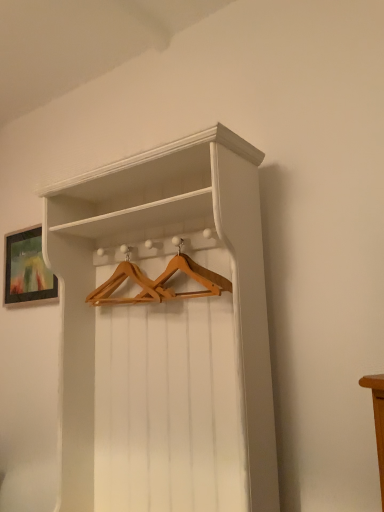
What do you see at coordinates (159, 282) in the screenshot?
I see `wooden hanger at center` at bounding box center [159, 282].

What is the approximate height of matte black picture frame at upper left?

matte black picture frame at upper left is 18.61 inches tall.

Describe the element at coordinates (27, 269) in the screenshot. Image resolution: width=384 pixels, height=512 pixels. I see `matte black picture frame at upper left` at that location.

I want to click on white wood shelf at center, so (x=165, y=332).

Describe the element at coordinates (165, 332) in the screenshot. I see `white wood shelf at center` at that location.

Where is `wooden hanger at center`? The width and height of the screenshot is (384, 512). wooden hanger at center is located at coordinates (159, 282).

Considering the positions of points (20, 286) and (170, 326), is point (20, 286) farther from camera compared to point (170, 326)?

Yes, it is behind point (170, 326).

Does matte black picture frame at upper left turn towards white wood shelf at center?

No, matte black picture frame at upper left is not turned towards white wood shelf at center.

Are matte black picture frame at upper left and white wood shelf at center beside each other?

No, matte black picture frame at upper left is not next to white wood shelf at center.

From a real-world perspective, is matte black picture frame at upper left below white wood shelf at center?

Incorrect, from a real-world perspective, matte black picture frame at upper left is higher than white wood shelf at center.

From the picture: Is wooden hanger at center in front of or behind matte black picture frame at upper left in the image?

Visually, wooden hanger at center is located in front of matte black picture frame at upper left.

Looking at this image, in the image, is wooden hanger at center on the left side or the right side of matte black picture frame at upper left?

wooden hanger at center is to the right of matte black picture frame at upper left.

Is wooden hanger at center turned away from matte black picture frame at upper left?

That's not correct — wooden hanger at center is not looking away from matte black picture frame at upper left.

From a real-world perspective, between wooden hanger at center and matte black picture frame at upper left, who is vertically higher?

From a 3D spatial view, matte black picture frame at upper left is above.

Does white wood shelf at center have a greater height compared to matte black picture frame at upper left?

Yes.

Considering the positions of point (171, 365) and point (14, 241), is point (171, 365) closer or farther from the camera than point (14, 241)?

Point (171, 365) is closer to the camera than point (14, 241).

How distant is white wood shelf at center from matte black picture frame at upper left?

They are 31.41 inches apart.

Which of these two, white wood shelf at center or matte black picture frame at upper left, is smaller?

matte black picture frame at upper left is smaller.

Is matte black picture frame at upper left wider or thinner than wooden hanger at center?

In the image, matte black picture frame at upper left appears to be more narrow than wooden hanger at center.

Considering the sizes of objects matte black picture frame at upper left and wooden hanger at center in the image provided, who is shorter, matte black picture frame at upper left or wooden hanger at center?

With less height is wooden hanger at center.

Is matte black picture frame at upper left looking in the opposite direction of wooden hanger at center?

No.

Who is smaller, wooden hanger at center or white wood shelf at center?

With smaller size is wooden hanger at center.

Looking at this image, does wooden hanger at center have a lesser width compared to white wood shelf at center?

Yes, wooden hanger at center is thinner than white wood shelf at center.

Is wooden hanger at center outside of white wood shelf at center?

No, wooden hanger at center is not outside of white wood shelf at center.

From the image's perspective, which object appears higher, white wood shelf at center or wooden hanger at center?

From the image's view, wooden hanger at center is above.

Is wooden hanger at center a part of white wood shelf at center?

Yes, white wood shelf at center contains wooden hanger at center.

Is the surface of white wood shelf at center in direct contact with wooden hanger at center?

No, white wood shelf at center is not touching wooden hanger at center.

Identify the location of shelf located underneath the matte black picture frame at upper left (from a real-world perspective). Image resolution: width=384 pixels, height=512 pixels. (165, 332).

Image resolution: width=384 pixels, height=512 pixels. I want to click on picture frame behind the wooden hanger at center, so click(x=27, y=269).

When comparing their distances from matte black picture frame at upper left, does white wood shelf at center or wooden hanger at center seem further?

white wood shelf at center.

Which object lies nearer to the anchor point white wood shelf at center, matte black picture frame at upper left or wooden hanger at center?

wooden hanger at center.

Looking at this image, based on their spatial positions, is wooden hanger at center or matte black picture frame at upper left further from white wood shelf at center?

matte black picture frame at upper left lies further to white wood shelf at center than the other object.

Estimate the real-world distances between objects in this image. Which object is further from matte black picture frame at upper left, wooden hanger at center or white wood shelf at center?

white wood shelf at center lies further to matte black picture frame at upper left than the other object.

Consider the image. From the image, which object appears to be nearer to wooden hanger at center, matte black picture frame at upper left or white wood shelf at center?

Among the two, white wood shelf at center is located nearer to wooden hanger at center.

When comparing their distances from wooden hanger at center, does white wood shelf at center or matte black picture frame at upper left seem further?

matte black picture frame at upper left is positioned further to the anchor wooden hanger at center.

Find the location of a particular element. This screenshot has width=384, height=512. hanger between white wood shelf at center and matte black picture frame at upper left along the z-axis is located at coordinates (159, 282).